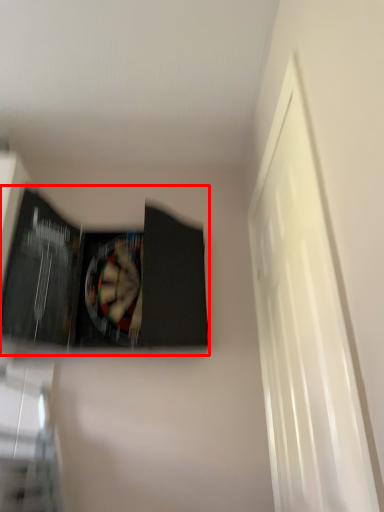
Question: Observing the image, what is the correct spatial positioning of paperback book (annotated by the red box) in reference to window?

Choices:
 (A) right
 (B) left

Answer: (B)